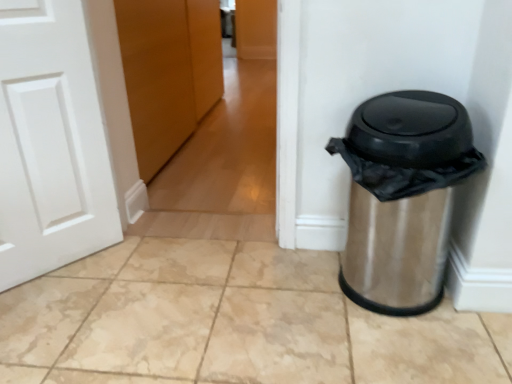
In order to click on free space to the left of stainless steel trash can at right in this screenshot , I will do `click(274, 297)`.